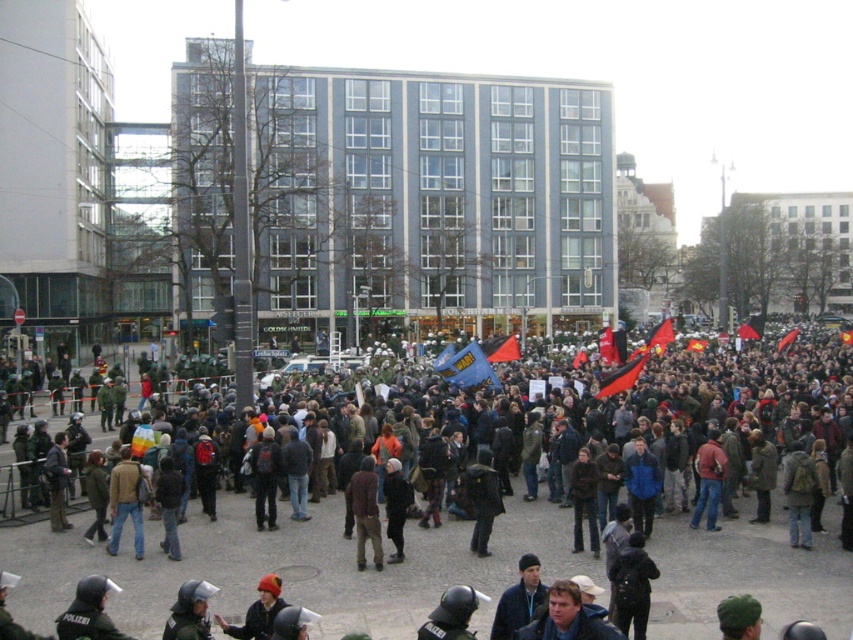
You are a photographer standing at the edge of the crowd in the public square. You want to take a closeup photo of the dark blue jacket at center. Given that your camera can focus on objects up to 15 meters away, will you be able to capture a clear image?

The dark blue jacket at center is 19.07 meters away from the viewer. Since the camera can only focus up to 15 meters, it will not be able to capture a clear image of the dark blue jacket at center.

You are a photographer standing at the edge of the crowd. You want to capture a photo that includes both the dark blue jacket at center and the red knit hat at lower center. What is the minimum distance you need to move forward to ensure both subjects are in frame?

The minimum distance you need to move forward is 4.02 meters to ensure both the dark blue jacket at center and the red knit hat at lower center are in frame, as they are currently 4.02 meters apart.